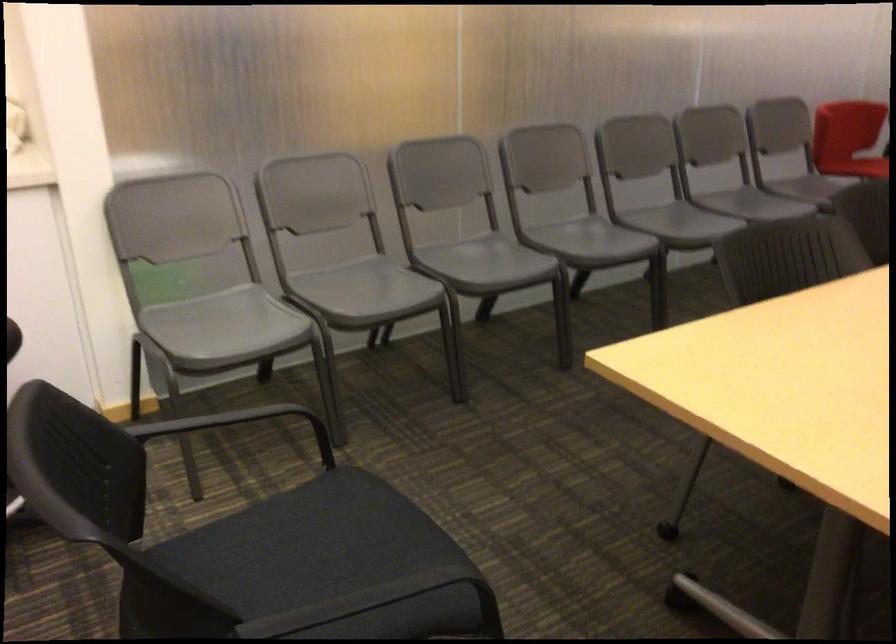
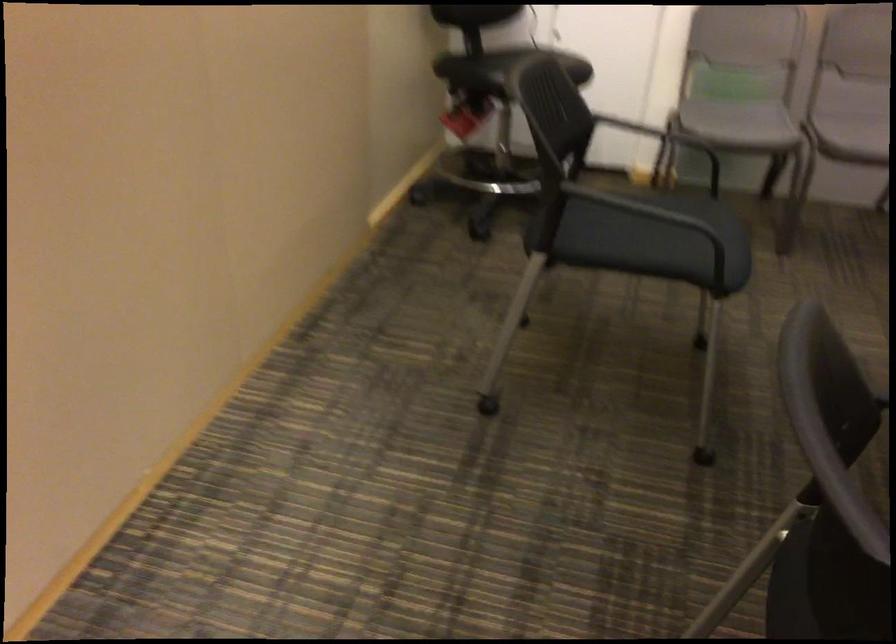
Where in the second image is the point corresponding to (x=340, y=290) from the first image?

(853, 128)